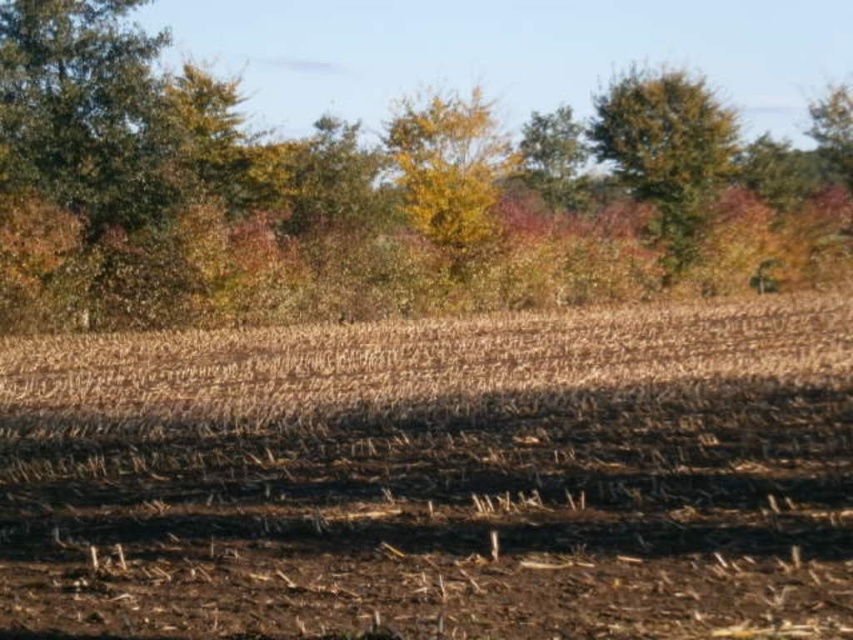
The width and height of the screenshot is (853, 640). What are the coordinates of `green leafy tree at upper right` in the screenshot? It's located at (666, 154).

Who is higher up, green leafy tree at upper right or yellow leafy tree at center?

green leafy tree at upper right

Between point (682, 92) and point (480, 209), which one is positioned in front?

Point (480, 209) is more forward.

At what (x,y) coordinates should I click in order to perform the action: click on green leafy tree at upper right. Please return your answer as a coordinate pair (x, y). This screenshot has width=853, height=640. Looking at the image, I should click on (666, 154).

Which is behind, point (637, 106) or point (463, 173)?

Positioned behind is point (637, 106).

Is point (399, 284) more distant than point (495, 188)?

That is False.

Who is more distant from viewer, (229,317) or (463,164)?

The point (463,164) is behind.

Image resolution: width=853 pixels, height=640 pixels. What are the coordinates of `yellow-green foliage at upper center` in the screenshot? It's located at (373, 195).

The height and width of the screenshot is (640, 853). What do you see at coordinates (436, 477) in the screenshot? I see `brown soil at center` at bounding box center [436, 477].

The image size is (853, 640). Describe the element at coordinates (436, 477) in the screenshot. I see `brown soil at center` at that location.

Locate an element on the screen. brown soil at center is located at coordinates [436, 477].